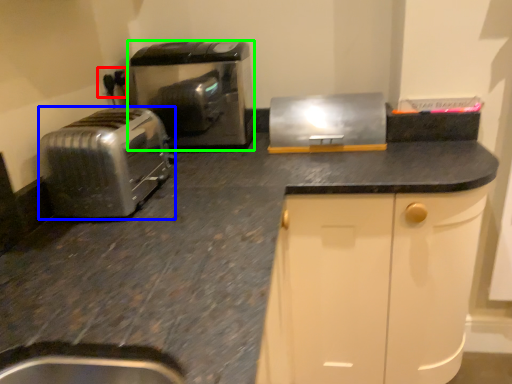
Question: Considering the real-world distances, which object is farthest from electric outlet (highlighted by a red box)? toaster (highlighted by a blue box) or home appliance (highlighted by a green box)?

Choices:
 (A) toaster
 (B) home appliance

Answer: (A)